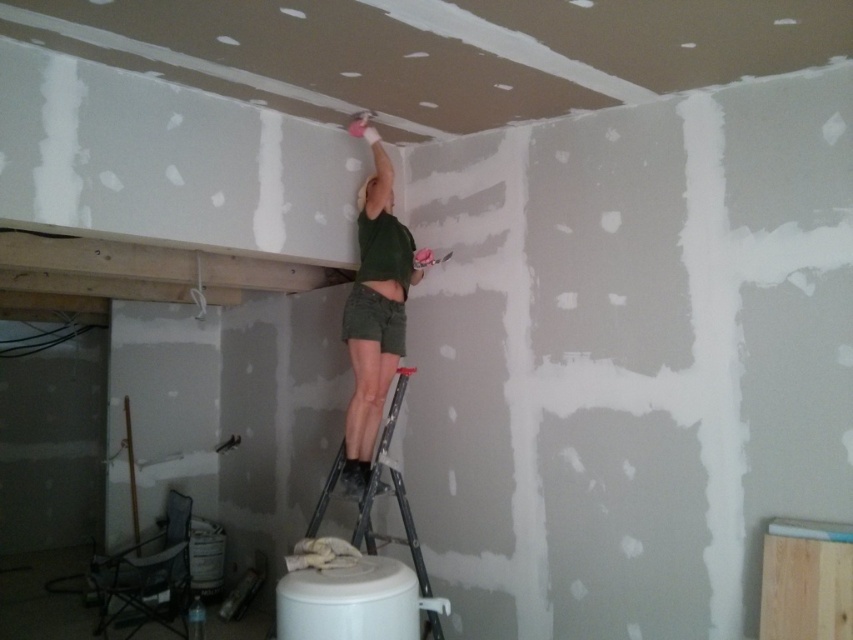
You are a safety inspector standing in the room and see the green matte shirt at upper center. According to safety regulations, workers must stay at least 3 meters away from the ceiling plastering area to avoid falling debris. Are they compliant?

The green matte shirt at upper center is 3.10 meters from the viewer, which meets the minimum 3 meters requirement, so the worker is compliant with safety regulations.

You are an interior designer assessing the renovation progress. You notice the green matte shirt at upper center and the metallic silver ladder at center in the room. Which object occupies more horizontal space in the image?

The metallic silver ladder at center occupies more horizontal space because the green matte shirt at upper center has a lesser width compared to it.